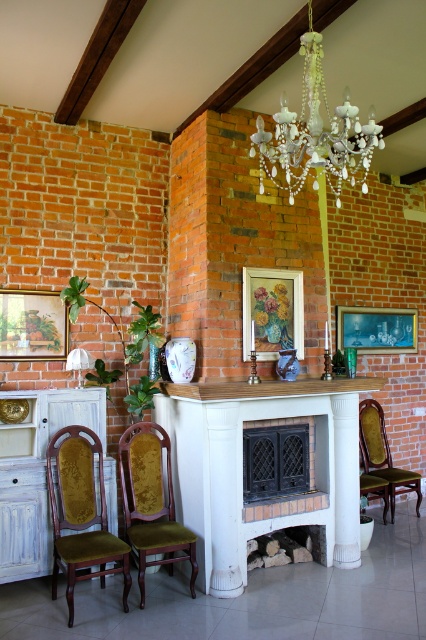
You are a delivery person carrying a package that is 1.5 meters long. You need to place it between the wooden mantel at center and the velvet gold chair at right. Is there enough space for the package?

The distance between the wooden mantel at center and the velvet gold chair at right is 1.37 meters. Since the package is 1.5 meters long, it won let you place it there because the space is shorter than the package.

You are planning to place a 4.5 feet wide sofa between the white wood fireplace at center and the velvet gold chair at right. Will there be enough space for the sofa?

The distance between the white wood fireplace at center and the velvet gold chair at right is 4.47 feet, which is slightly less than the sofa width of 4.5 feet. Therefore, the sofa will not fit in the available space.

You are a guest in this room and want to place a small decorative item on the velvet green chair at center and the wooden picture frame at center. Which object can you place the item on without it falling off?

The velvet green chair at center is much taller than the wooden picture frame at center, so placing the item on the wooden picture frame at center would be safer to prevent it from falling off.